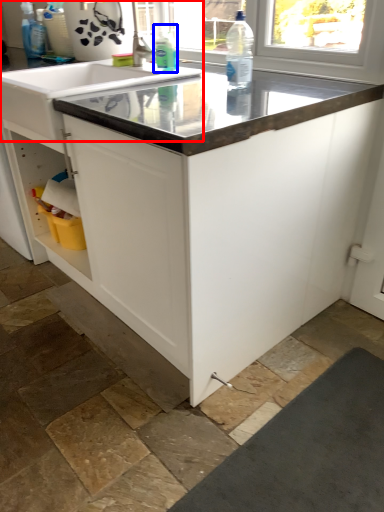
Question: Which object is further to the camera taking this photo, sink (highlighted by a red box) or cleaning product (highlighted by a blue box)?

Choices:
 (A) sink
 (B) cleaning product

Answer: (B)